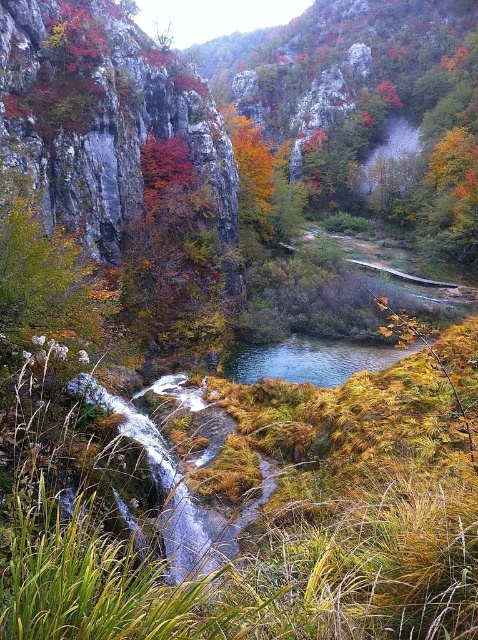
In the autumn landscape, you see a rustic stone cliff at center and autumn leaves at center. Which object is positioned to the left?

The rustic stone cliff at center is to the left of autumn leaves at center.

You are standing at the base of the rustic stone cliff at center and want to reach the green glossy water at center. Can you walk directly to it without climbing?

The rustic stone cliff at center is located above the green glossy water at center, so you would need to climb down the cliff to reach the water directly.

You are planning to paint this autumn landscape. You have two canvases, one 1 meter wide and another 2 meters wide. Which canvas should you choose to capture both the rustic stone cliff at center and the green glossy water at center without cropping either?

The green glossy water at center is wider than the rustic stone cliff at center. Since the 2 meter wide canvas can accommodate both objects comfortably, you should choose the 2 meter wide canvas to ensure neither the rustic stone cliff at center nor the green glossy water at center gets cropped.